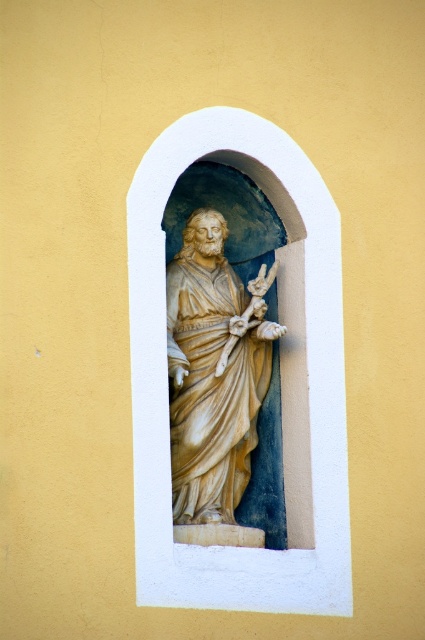
Question: Is white stone statue at center smaller than gold textured crucifix at center?

Choices:
 (A) no
 (B) yes

Answer: (A)

Question: Which point is closer to the camera?

Choices:
 (A) gold textured crucifix at center
 (B) white stone statue at center

Answer: (B)

Question: Which point is farther to the camera?

Choices:
 (A) white stone statue at center
 (B) gold textured crucifix at center
 (C) beige marble statue at center

Answer: (B)

Question: Considering the relative positions of beige marble statue at center and gold textured crucifix at center in the image provided, where is beige marble statue at center located with respect to gold textured crucifix at center?

Choices:
 (A) below
 (B) above

Answer: (A)

Question: Which point is closer to the camera?

Choices:
 (A) white stone statue at center
 (B) gold textured crucifix at center
 (C) beige marble statue at center

Answer: (A)

Question: Can you confirm if white stone statue at center is bigger than gold textured crucifix at center?

Choices:
 (A) no
 (B) yes

Answer: (B)